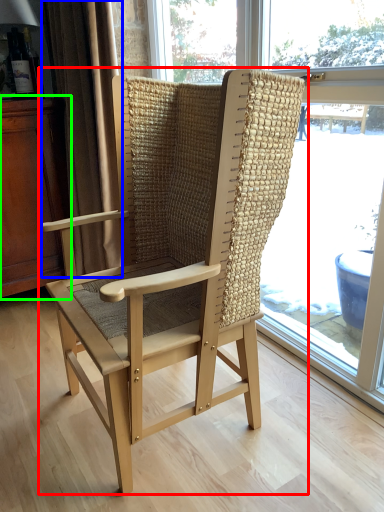
Question: Which object is the closest to the chair (highlighted by a red box)? Choose among these: curtain (highlighted by a blue box) or dresser (highlighted by a green box).

Choices:
 (A) curtain
 (B) dresser

Answer: (A)